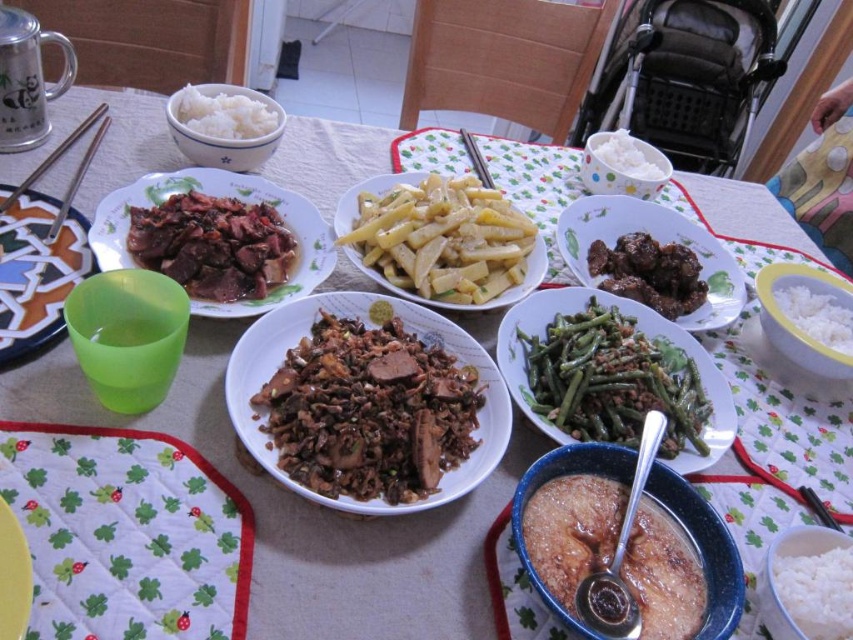
Which of these two, brown matte meat at center or slightly browned paste at center, stands shorter?

Standing shorter between the two is slightly browned paste at center.

Does point (369, 481) come closer to viewer compared to point (538, 513)?

No, it is behind (538, 513).

Is point (405, 332) behind point (561, 520)?

That is True.

Where is `brown matte meat at center`? brown matte meat at center is located at coordinates (369, 410).

Can you confirm if green matte string beans at center is positioned below slightly browned paste at center?

Incorrect, green matte string beans at center is not positioned below slightly browned paste at center.

Who is positioned more to the right, green matte string beans at center or slightly browned paste at center?

From the viewer's perspective, green matte string beans at center appears more on the right side.

What do you see at coordinates (611, 380) in the screenshot? I see `green matte string beans at center` at bounding box center [611, 380].

The height and width of the screenshot is (640, 853). Identify the location of green matte string beans at center. (611, 380).

Can you confirm if brown matte meat at center is positioned to the left of yellowish matte potato at center?

Indeed, brown matte meat at center is positioned on the left side of yellowish matte potato at center.

Who is more distant from viewer, (456, 403) or (407, 211)?

The point (407, 211) is behind.

Find the location of `brown matte meat at center`. brown matte meat at center is located at coordinates (369, 410).